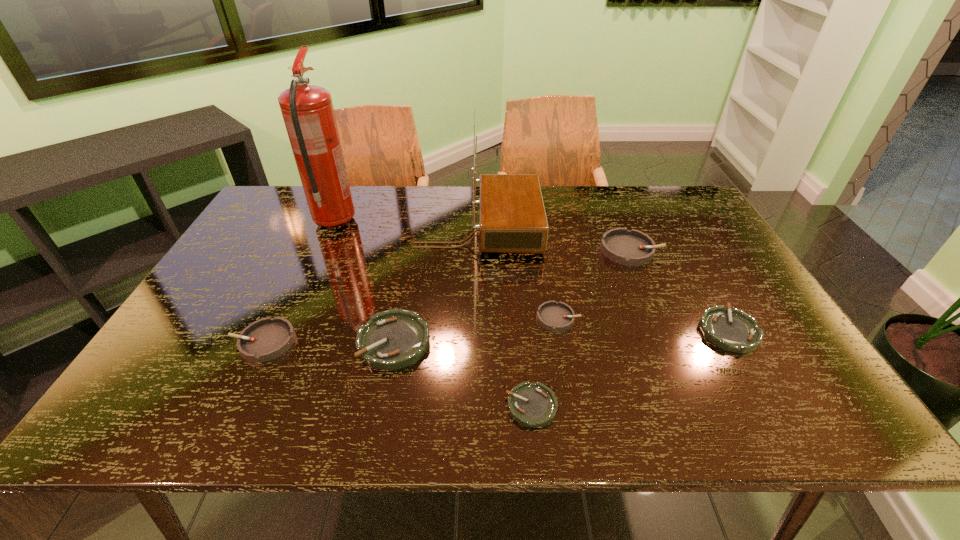
What are the coordinates of `free location located 0.100m on the back of the smallest gray ashtray` in the screenshot? It's located at (551, 279).

The width and height of the screenshot is (960, 540). Identify the location of vacant region located on the front of the rightmost green ashtray. (760, 387).

The image size is (960, 540). I want to click on vacant area situated on the back of the shortest object, so click(524, 330).

This screenshot has width=960, height=540. What are the coordinates of `fire extinguisher situated at the far edge` in the screenshot? It's located at (308, 113).

At what (x,y) coordinates should I click in order to perform the action: click on radio_receiver that is at the far edge. Please return your answer as a coordinate pair (x, y). This screenshot has width=960, height=540. Looking at the image, I should click on (512, 219).

This screenshot has width=960, height=540. Identify the location of object situated at the near edge. (534, 405).

Identify the location of object that is at the left edge. (268, 338).

Identify the location of object at the right edge. This screenshot has height=540, width=960. (733, 330).

In the image, there is a desktop. Identify the location of vacant area at the far edge. (374, 207).

In the image, there is a desktop. At what (x,y) coordinates should I click in order to perform the action: click on vacant space at the near edge. Please return your answer as a coordinate pair (x, y). Looking at the image, I should click on (324, 393).